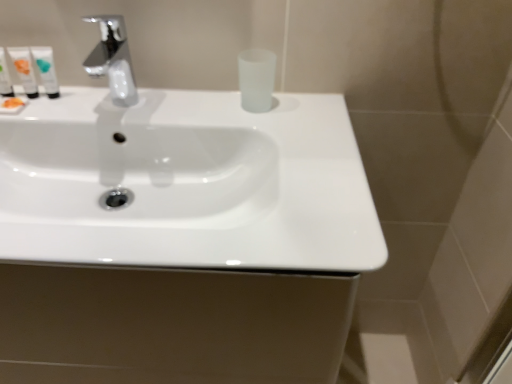
Identify the location of vacant area in front of frosted glass cup at center, the fourth mouthwash viewed from the left. The image size is (512, 384). (271, 147).